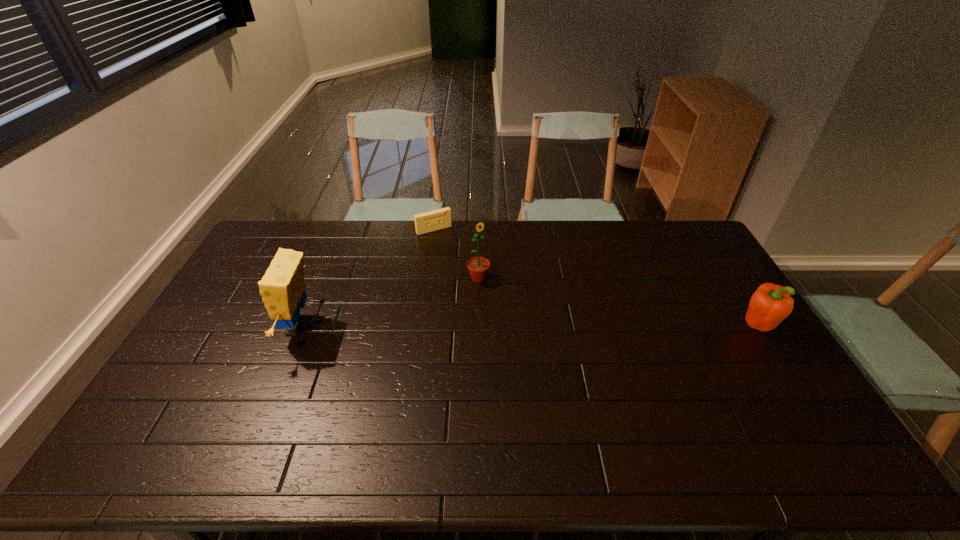
Locate an element on the screen. This screenshot has height=540, width=960. vacant area at the near edge is located at coordinates (x=408, y=424).

Locate an element on the screen. Image resolution: width=960 pixels, height=540 pixels. vacant point at the left edge is located at coordinates (206, 338).

In the image, there is a desktop. At what (x,y) coordinates should I click in order to perform the action: click on vacant space at the right edge. Please return your answer as a coordinate pair (x, y). The image size is (960, 540). Looking at the image, I should click on (721, 289).

This screenshot has height=540, width=960. I want to click on empty space that is in between the sponge and the second object from left to right, so click(x=365, y=278).

The width and height of the screenshot is (960, 540). What are the coordinates of `vacant area that lies between the farthest object and the second farthest object` in the screenshot? It's located at coord(456,254).

You are a GUI agent. You are given a task and a screenshot of the screen. Output one action in this format:
    pyautogui.click(x=<x>, y=<y>)
    Task: Click on the vacant area between the second object from left to right and the sunflower
    Image resolution: width=960 pixels, height=540 pixels.
    Given the screenshot: What is the action you would take?
    pyautogui.click(x=456, y=254)

The image size is (960, 540). What are the coordinates of `empty space between the farthest object and the third tallest object` in the screenshot? It's located at [x=595, y=278].

At what (x,y) coordinates should I click in order to perform the action: click on free area in between the third object from left to right and the sponge. Please return your answer as a coordinate pair (x, y). The height and width of the screenshot is (540, 960). Looking at the image, I should click on (388, 302).

Where is `free space between the sunflower and the second object from left to right`? free space between the sunflower and the second object from left to right is located at coordinates (456, 254).

Find the location of `free space between the sponge and the second shortest object`. free space between the sponge and the second shortest object is located at coordinates (526, 327).